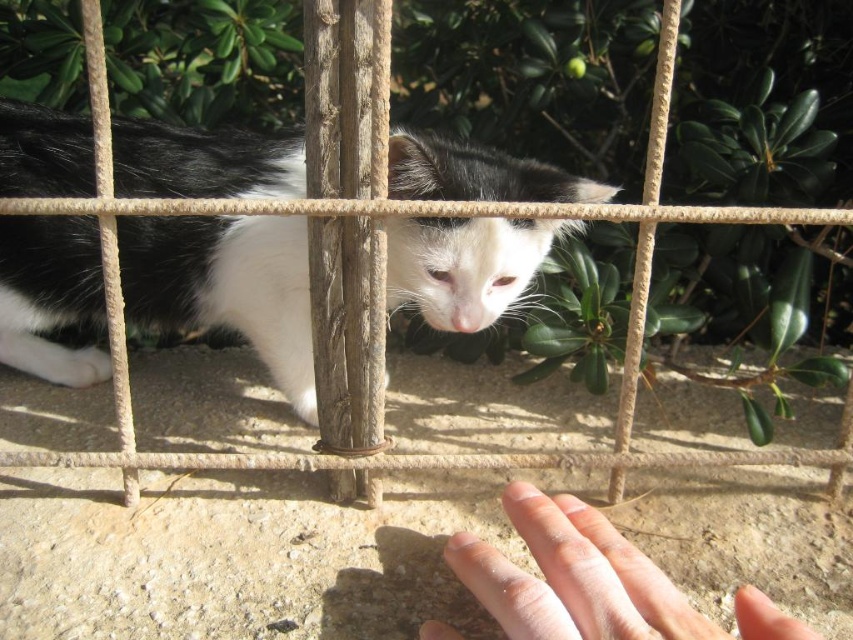
Between point (271, 272) and point (537, 580), which one is positioned behind?

Positioned behind is point (271, 272).

Does black and white fur cat at center have a greater height compared to pale skin at lower center?

Correct, black and white fur cat at center is much taller as pale skin at lower center.

Find the location of `black and white fur cat at center`. black and white fur cat at center is located at coordinates (225, 285).